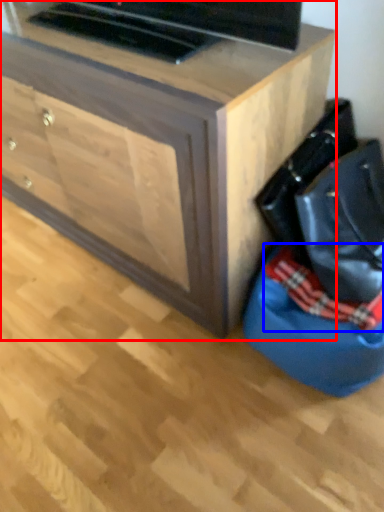
Question: Which object appears closest to the camera in this image, chest of drawers (highlighted by a red box) or blanket (highlighted by a blue box)?

Choices:
 (A) chest of drawers
 (B) blanket

Answer: (A)